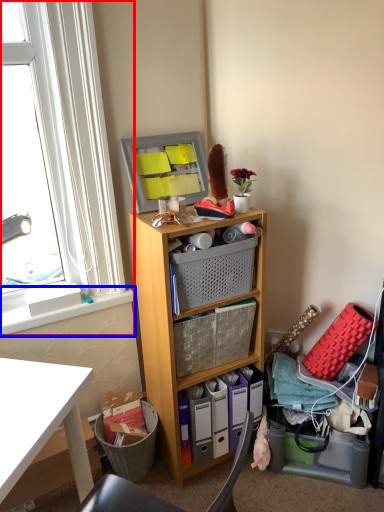
Question: Which of the following is the closest to the observer, window (highlighted by a red box) or window sill (highlighted by a blue box)?

Choices:
 (A) window
 (B) window sill

Answer: (A)